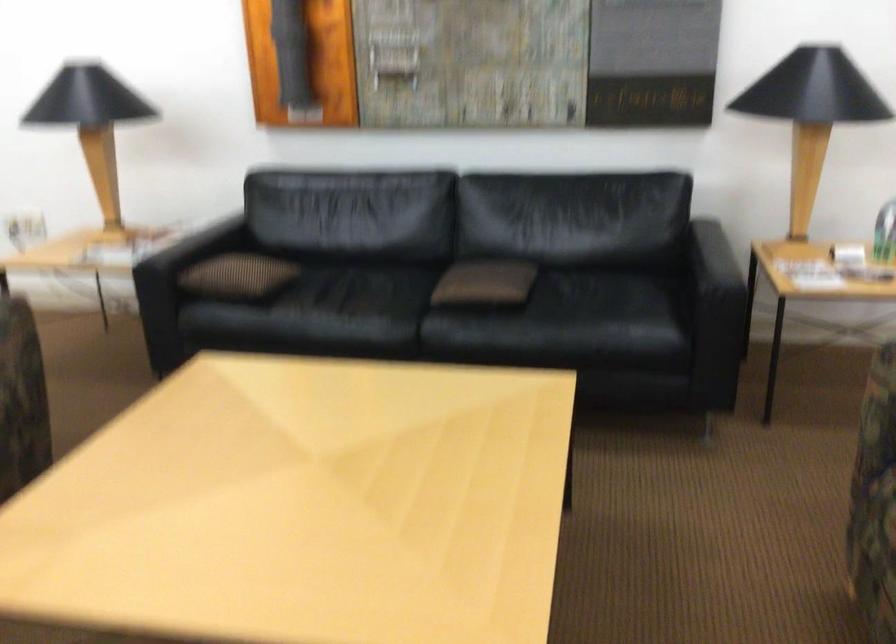
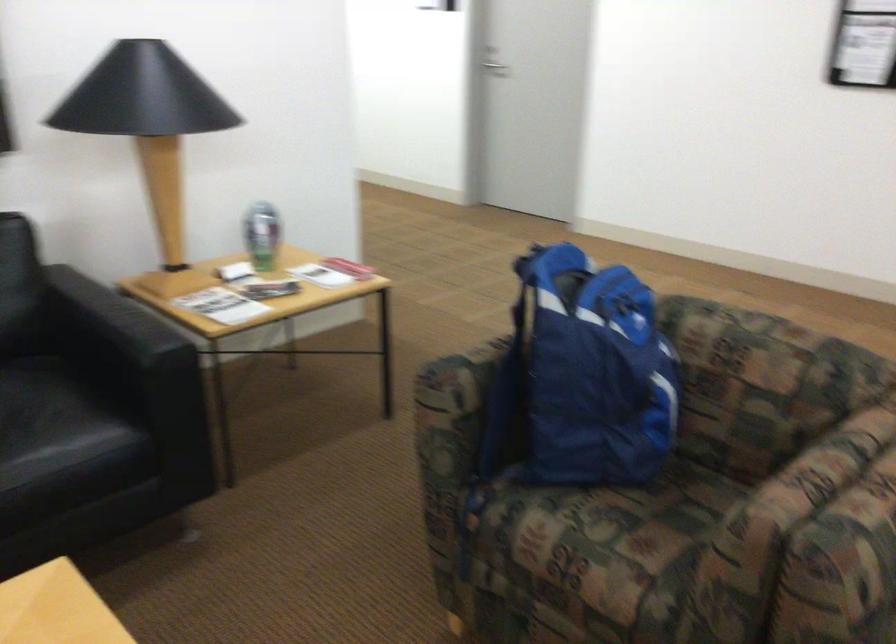
Question: The camera is either moving clockwise (left) or counter-clockwise (right) around the object. The first image is from the beginning of the video and the second image is from the end. Is the camera moving left or right when shooting the video?

Choices:
 (A) Left
 (B) Right

Answer: (A)